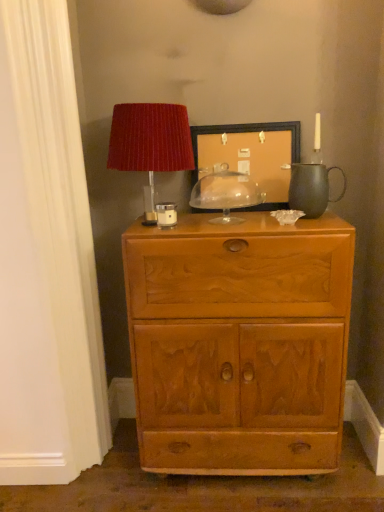
Question: From a real-world perspective, is light brown wood chest of drawers at center physically below clear glass dome at center, arranged as the 1th candle holder when viewed from the right?

Choices:
 (A) yes
 (B) no

Answer: (A)

Question: Does light brown wood chest of drawers at center have a lesser width compared to clear glass dome at center, positioned as the 2th candle holder in left-to-right order?

Choices:
 (A) no
 (B) yes

Answer: (A)

Question: From the image's perspective, is light brown wood chest of drawers at center on clear glass dome at center, which appears as the 2th candle holder when viewed from the front?

Choices:
 (A) no
 (B) yes

Answer: (A)

Question: Is light brown wood chest of drawers at center completely or partially outside of clear glass dome at center, which appears as the 2th candle holder when viewed from the front?

Choices:
 (A) no
 (B) yes

Answer: (B)

Question: Is light brown wood chest of drawers at center to the left of clear glass dome at center, which appears as the 2th candle holder when viewed from the front, from the viewer's perspective?

Choices:
 (A) yes
 (B) no

Answer: (A)

Question: Does light brown wood chest of drawers at center have a smaller size compared to clear glass dome at center, arranged as the 1th candle holder when viewed from the right?

Choices:
 (A) no
 (B) yes

Answer: (A)

Question: Considering the relative sizes of matte red lampshade at upper left and wooden picture frame at center in the image provided, is matte red lampshade at upper left thinner than wooden picture frame at center?

Choices:
 (A) yes
 (B) no

Answer: (B)

Question: Can you confirm if matte red lampshade at upper left is shorter than wooden picture frame at center?

Choices:
 (A) no
 (B) yes

Answer: (A)

Question: Is matte red lampshade at upper left not close to wooden picture frame at center?

Choices:
 (A) no
 (B) yes

Answer: (A)

Question: Considering the relative sizes of matte red lampshade at upper left and wooden picture frame at center in the image provided, is matte red lampshade at upper left taller than wooden picture frame at center?

Choices:
 (A) yes
 (B) no

Answer: (A)

Question: Is matte red lampshade at upper left positioned behind wooden picture frame at center?

Choices:
 (A) yes
 (B) no

Answer: (B)

Question: Is matte red lampshade at upper left directly adjacent to wooden picture frame at center?

Choices:
 (A) yes
 (B) no

Answer: (B)

Question: Is matte white candle holder at upper center, the 2th candle holder from the back, at the back of clear glass dome at center, arranged as the 1th candle holder when viewed from the right?

Choices:
 (A) no
 (B) yes

Answer: (A)